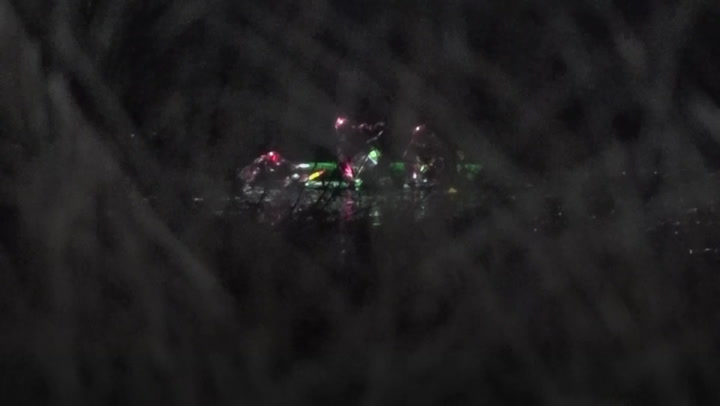
This screenshot has height=406, width=720. Find the location of `lights`. lights is located at coordinates (351, 172), (276, 162), (343, 129), (420, 134).